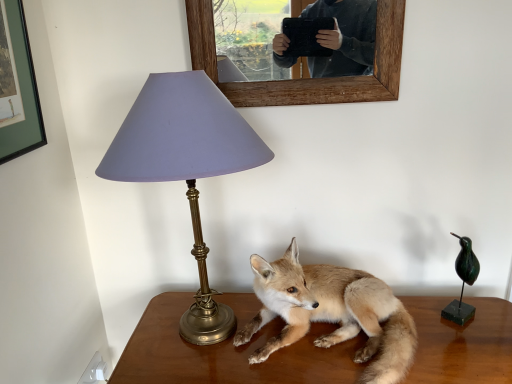
Question: Relative to brown wooden table at center, is wooden picture frame at upper center in front or behind?

Choices:
 (A) behind
 (B) front

Answer: (A)

Question: From a real-world perspective, is wooden picture frame at upper center positioned above or below brown wooden table at center?

Choices:
 (A) above
 (B) below

Answer: (A)

Question: Which object is positioned farthest from the brown wooden table at center?

Choices:
 (A) furry golden fox at center
 (B) matte purple shade at left
 (C) wooden picture frame at upper center

Answer: (C)

Question: Estimate the real-world distances between objects in this image. Which object is farther from the matte purple shade at left?

Choices:
 (A) brown wooden table at center
 (B) wooden picture frame at upper center
 (C) furry golden fox at center

Answer: (A)